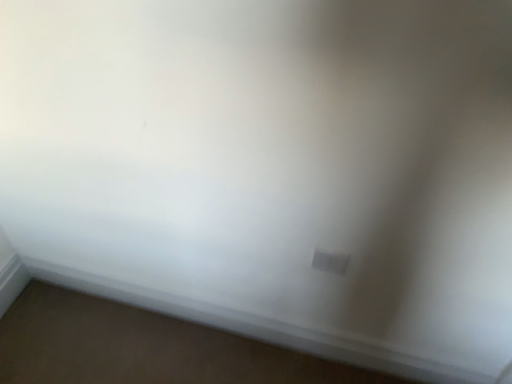
Question: Considering the relative positions of white plastic electric outlet at lower right and white smooth baseboard at lower center in the image provided, is white plastic electric outlet at lower right to the right of white smooth baseboard at lower center from the viewer's perspective?

Choices:
 (A) no
 (B) yes

Answer: (B)

Question: Is white plastic electric outlet at lower right not close to white smooth baseboard at lower center?

Choices:
 (A) no
 (B) yes

Answer: (A)

Question: Could white smooth baseboard at lower center be considered to be inside white plastic electric outlet at lower right?

Choices:
 (A) no
 (B) yes

Answer: (A)

Question: Is white plastic electric outlet at lower right to the left of white smooth baseboard at lower center from the viewer's perspective?

Choices:
 (A) yes
 (B) no

Answer: (B)

Question: Does white plastic electric outlet at lower right touch white smooth baseboard at lower center?

Choices:
 (A) no
 (B) yes

Answer: (A)

Question: Is white plastic electric outlet at lower right closer to camera compared to white smooth baseboard at lower center?

Choices:
 (A) yes
 (B) no

Answer: (A)

Question: Is white plastic electric outlet at lower right at the back of white smooth baseboard at lower center?

Choices:
 (A) no
 (B) yes

Answer: (A)

Question: Is white smooth baseboard at lower center bigger than white plastic electric outlet at lower right?

Choices:
 (A) yes
 (B) no

Answer: (A)

Question: Is white plastic electric outlet at lower right a part of white smooth baseboard at lower center?

Choices:
 (A) no
 (B) yes

Answer: (A)

Question: From a real-world perspective, is white smooth baseboard at lower center physically below white plastic electric outlet at lower right?

Choices:
 (A) no
 (B) yes

Answer: (B)

Question: Is white smooth baseboard at lower center in contact with white plastic electric outlet at lower right?

Choices:
 (A) no
 (B) yes

Answer: (A)

Question: Does white smooth baseboard at lower center have a greater width compared to white plastic electric outlet at lower right?

Choices:
 (A) no
 (B) yes

Answer: (B)

Question: Is white smooth baseboard at lower center to the left or to the right of white plastic electric outlet at lower right in the image?

Choices:
 (A) right
 (B) left

Answer: (B)